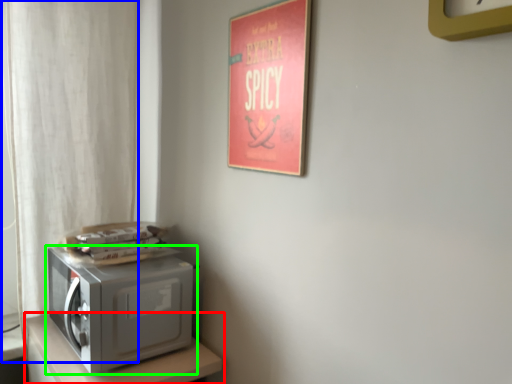
Question: Which object is the farthest from furniture (highlighted by a red box)? Choose among these: curtain (highlighted by a blue box) or home appliance (highlighted by a green box).

Choices:
 (A) curtain
 (B) home appliance

Answer: (A)